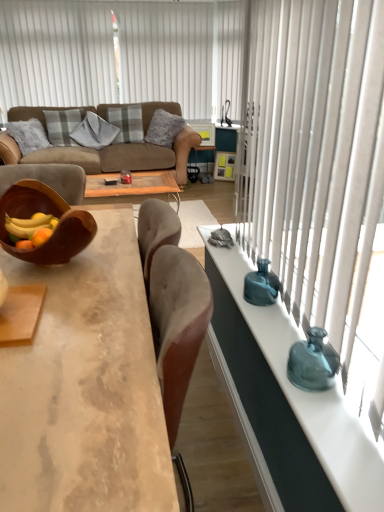
You are a GUI agent. You are given a task and a screenshot of the screen. Output one action in this format:
    pyautogui.click(x=<x>, y=<y>)
    Task: Click on the vacant space situated above concrete textured coffee table at center (from a real-world perspective)
    This screenshot has height=512, width=384.
    Given the screenshot: What is the action you would take?
    pyautogui.click(x=76, y=292)